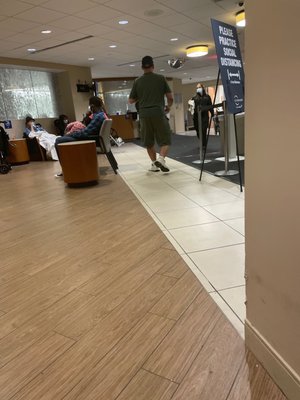
The image size is (300, 400). In order to click on wood flooring in this screenshot , I will do `click(181, 299)`.